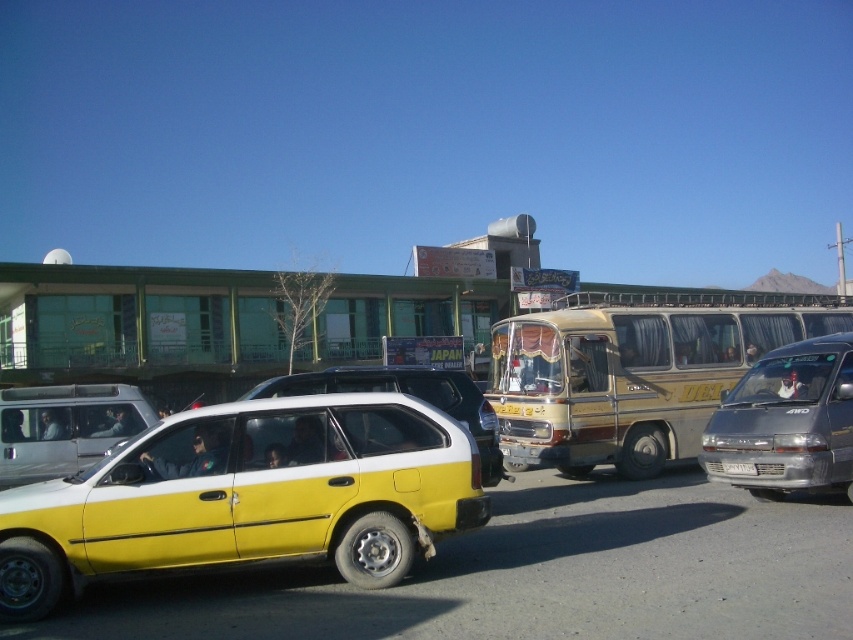
Question: Which object is positioned farthest from the metallic silver van at center?

Choices:
 (A) yellow matte hatchback at lower left
 (B) yellow matte car at center
 (C) white plastic license plate at center
 (D) metallic silver sedan at center

Answer: (B)

Question: Which object is closer to the camera taking this photo?

Choices:
 (A) metallic silver sedan at center
 (B) yellow matte hatchback at lower left
 (C) metallic silver van at center
 (D) white plastic license plate at center

Answer: (B)

Question: Is yellow matte hatchback at lower left wider than yellow matte car at center?

Choices:
 (A) no
 (B) yes

Answer: (A)

Question: Can you confirm if yellow matte hatchback at lower left is thinner than yellow matte car at center?

Choices:
 (A) no
 (B) yes

Answer: (B)

Question: Is gold metallic bus at center positioned before yellow matte car at center?

Choices:
 (A) no
 (B) yes

Answer: (A)

Question: Which object is farther from the camera taking this photo?

Choices:
 (A) metallic silver sedan at center
 (B) yellow matte car at center

Answer: (A)